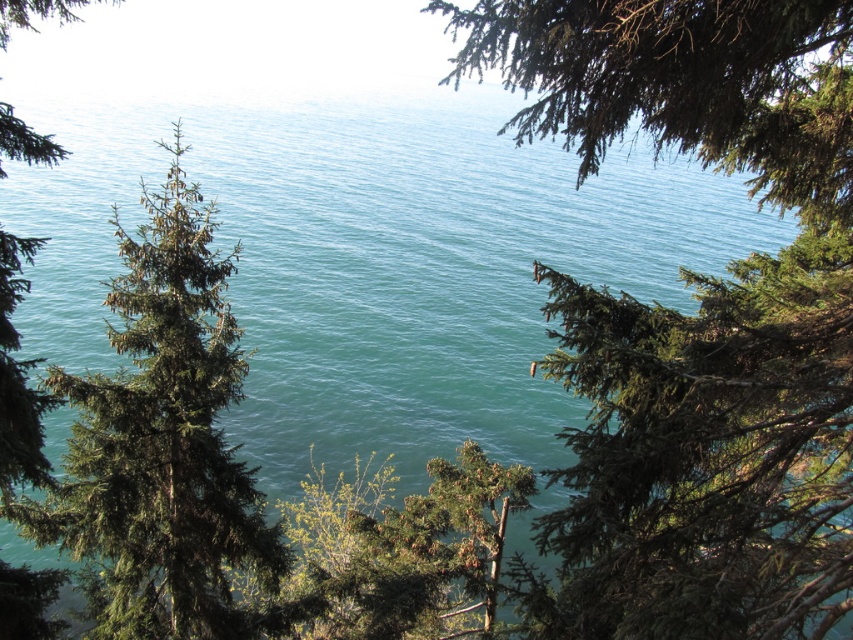
Question: Based on their relative distances, which object is nearer to the green needle-like pine at left?

Choices:
 (A) green needle-like foliage at center
 (B) green matte tree at upper right

Answer: (A)

Question: Estimate the real-world distances between objects in this image. Which object is farther from the green matte tree at upper right?

Choices:
 (A) green needle-like pine at left
 (B) green needle-like foliage at center

Answer: (A)

Question: Can you confirm if green needle-like foliage at center is positioned to the right of green matte tree at upper right?

Choices:
 (A) yes
 (B) no

Answer: (B)

Question: Can you confirm if green needle-like foliage at center is bigger than green matte tree at upper right?

Choices:
 (A) yes
 (B) no

Answer: (B)

Question: Which point appears farthest from the camera in this image?

Choices:
 (A) (711, 113)
 (B) (531, 134)
 (C) (51, 522)

Answer: (C)

Question: Can you confirm if green needle-like pine at left is smaller than green matte tree at upper right?

Choices:
 (A) no
 (B) yes

Answer: (B)